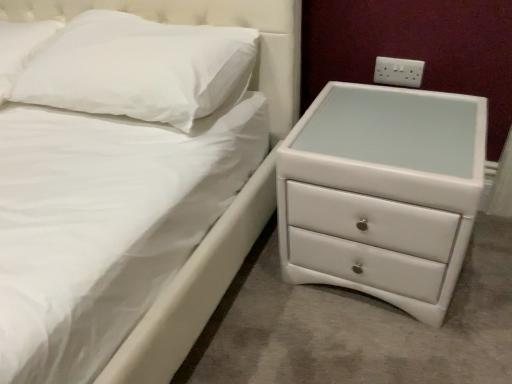
Measure the distance between point (375, 73) and camera.

Point (375, 73) and camera are 1.39 meters apart from each other.

The height and width of the screenshot is (384, 512). I want to click on white glossy chest of drawers at right, so click(x=382, y=193).

Is white plastic electrical outlet at upper right closer to the viewer compared to white matte pillow at upper left, which is counted as the 1th pillow, starting from the left?

No, the depth of white plastic electrical outlet at upper right is greater than that of white matte pillow at upper left, which is counted as the 1th pillow, starting from the left.

Is white plastic electrical outlet at upper right taller or shorter than white matte pillow at upper left, arranged as the 2th pillow when viewed from the right?

Clearly, white plastic electrical outlet at upper right is shorter compared to white matte pillow at upper left, arranged as the 2th pillow when viewed from the right.

Is white plastic electrical outlet at upper right spatially inside white matte pillow at upper left, arranged as the 2th pillow when viewed from the right, or outside of it?

The correct answer is: outside.

Does white plastic electrical outlet at upper right turn towards white matte pillow at upper left, arranged as the 2th pillow when viewed from the right?

No, white plastic electrical outlet at upper right is not oriented towards white matte pillow at upper left, arranged as the 2th pillow when viewed from the right.

Considering the relative sizes of white soft pillow at upper left, marked as the second pillow in a left-to-right arrangement, and white plastic electrical outlet at upper right in the image provided, is white soft pillow at upper left, marked as the second pillow in a left-to-right arrangement, thinner than white plastic electrical outlet at upper right?

No.

Is point (168, 36) behind point (399, 79)?

No, (168, 36) is in front of (399, 79).

Based on the photo, can we say white soft pillow at upper left, marked as the second pillow in a left-to-right arrangement, lies outside white plastic electrical outlet at upper right?

Indeed, white soft pillow at upper left, marked as the second pillow in a left-to-right arrangement, is completely outside white plastic electrical outlet at upper right.

Consider the image. From the image's perspective, is white soft pillow at upper left, marked as the second pillow in a left-to-right arrangement, over white plastic electrical outlet at upper right?

No, from the image's perspective, white soft pillow at upper left, marked as the second pillow in a left-to-right arrangement, is not on top of white plastic electrical outlet at upper right.

Which is more to the left, white matte pillow at upper left, arranged as the 2th pillow when viewed from the right, or white glossy chest of drawers at right?

From the viewer's perspective, white matte pillow at upper left, arranged as the 2th pillow when viewed from the right, appears more on the left side.

How distant is white matte pillow at upper left, which is counted as the 1th pillow, starting from the left, from white glossy chest of drawers at right?

1.08 meters.

From a real-world perspective, is white matte pillow at upper left, arranged as the 2th pillow when viewed from the right, below white glossy chest of drawers at right?

No, from a real-world perspective, white matte pillow at upper left, arranged as the 2th pillow when viewed from the right, is not below white glossy chest of drawers at right.

Relative to white glossy chest of drawers at right, is white matte pillow at upper left, which is counted as the 1th pillow, starting from the left, in front or behind?

white matte pillow at upper left, which is counted as the 1th pillow, starting from the left, is behind white glossy chest of drawers at right.

Based on the photo, does white soft pillow at upper left, marked as the second pillow in a left-to-right arrangement, have a lesser height compared to white matte pillow at upper left, arranged as the 2th pillow when viewed from the right?

No.

Which is less distant, (x=154, y=81) or (x=2, y=70)?

Positioned in front is point (x=154, y=81).

Is white matte pillow at upper left, which is counted as the 1th pillow, starting from the left, at the back of white soft pillow at upper left, which is the first pillow in right-to-left order?

No.

Does white plastic electrical outlet at upper right have a larger size compared to white glossy chest of drawers at right?

No.

Would you say white plastic electrical outlet at upper right is to the left or to the right of white glossy chest of drawers at right in the picture?

white plastic electrical outlet at upper right is positioned on white glossy chest of drawers at right's right side.

Is white plastic electrical outlet at upper right turned away from white glossy chest of drawers at right?

white plastic electrical outlet at upper right does not have its back to white glossy chest of drawers at right.

From a real-world perspective, which is physically below, white plastic electrical outlet at upper right or white glossy chest of drawers at right?

white glossy chest of drawers at right.

From the image's perspective, is white matte pillow at upper left, arranged as the 2th pillow when viewed from the right, over white soft pillow at upper left, which is the first pillow in right-to-left order?

Yes, from the image's perspective, white matte pillow at upper left, arranged as the 2th pillow when viewed from the right, is on top of white soft pillow at upper left, which is the first pillow in right-to-left order.

Which is closer, (10, 92) or (227, 85)?

Point (10, 92).

From a real-world perspective, is white matte pillow at upper left, which is counted as the 1th pillow, starting from the left, above or below white soft pillow at upper left, marked as the second pillow in a left-to-right arrangement?

From a real-world perspective, white matte pillow at upper left, which is counted as the 1th pillow, starting from the left, is physically below white soft pillow at upper left, marked as the second pillow in a left-to-right arrangement.

Would you say white matte pillow at upper left, arranged as the 2th pillow when viewed from the right, is inside or outside white soft pillow at upper left, marked as the second pillow in a left-to-right arrangement?

white matte pillow at upper left, arranged as the 2th pillow when viewed from the right, lies outside white soft pillow at upper left, marked as the second pillow in a left-to-right arrangement.

From the image's perspective, which one is positioned lower, white glossy chest of drawers at right or white plastic electrical outlet at upper right?

white glossy chest of drawers at right, from the image's perspective.

Is point (292, 149) closer or farther from the camera than point (396, 77)?

Point (292, 149).

Do you think white glossy chest of drawers at right is within white plastic electrical outlet at upper right, or outside of it?

white glossy chest of drawers at right is not inside white plastic electrical outlet at upper right, it's outside.

I want to click on the 1st pillow in front when counting from the white plastic electrical outlet at upper right, so click(x=21, y=48).

Find the location of a particular element. The width and height of the screenshot is (512, 384). electric outlet that appears above the white soft pillow at upper left, which is the first pillow in right-to-left order (from the image's perspective) is located at coordinates (398, 72).

When comparing their distances from white soft pillow at upper left, which is the first pillow in right-to-left order, does white glossy chest of drawers at right or white matte pillow at upper left, arranged as the 2th pillow when viewed from the right, seem closer?

white matte pillow at upper left, arranged as the 2th pillow when viewed from the right, lies closer to white soft pillow at upper left, which is the first pillow in right-to-left order, than the other object.

Which object lies further to the anchor point white matte pillow at upper left, which is counted as the 1th pillow, starting from the left, white soft pillow at upper left, which is the first pillow in right-to-left order, or white glossy chest of drawers at right?

white glossy chest of drawers at right.

Based on their spatial positions, is white matte pillow at upper left, arranged as the 2th pillow when viewed from the right, or white plastic electrical outlet at upper right closer to white glossy chest of drawers at right?

Based on the image, white plastic electrical outlet at upper right appears to be nearer to white glossy chest of drawers at right.

Based on their spatial positions, is white glossy chest of drawers at right or white plastic electrical outlet at upper right further from white soft pillow at upper left, marked as the second pillow in a left-to-right arrangement?

white plastic electrical outlet at upper right lies further to white soft pillow at upper left, marked as the second pillow in a left-to-right arrangement, than the other object.

Based on their spatial positions, is white glossy chest of drawers at right or white soft pillow at upper left, marked as the second pillow in a left-to-right arrangement, further from white plastic electrical outlet at upper right?

white soft pillow at upper left, marked as the second pillow in a left-to-right arrangement, is further to white plastic electrical outlet at upper right.

Estimate the real-world distances between objects in this image. Which object is closer to white plastic electrical outlet at upper right, white soft pillow at upper left, marked as the second pillow in a left-to-right arrangement, or white matte pillow at upper left, arranged as the 2th pillow when viewed from the right?

white soft pillow at upper left, marked as the second pillow in a left-to-right arrangement.

Looking at the image, which one is located further to white plastic electrical outlet at upper right, white matte pillow at upper left, which is counted as the 1th pillow, starting from the left, or white soft pillow at upper left, which is the first pillow in right-to-left order?

The object further to white plastic electrical outlet at upper right is white matte pillow at upper left, which is counted as the 1th pillow, starting from the left.

From the image, which object appears to be nearer to white glossy chest of drawers at right, white soft pillow at upper left, which is the first pillow in right-to-left order, or white matte pillow at upper left, arranged as the 2th pillow when viewed from the right?

The object closer to white glossy chest of drawers at right is white soft pillow at upper left, which is the first pillow in right-to-left order.

In order to click on chest of drawers between white matte pillow at upper left, arranged as the 2th pillow when viewed from the right, and white plastic electrical outlet at upper right in this screenshot , I will do `click(382, 193)`.

Where is `pillow situated between white matte pillow at upper left, which is counted as the 1th pillow, starting from the left, and white glossy chest of drawers at right from left to right`? The height and width of the screenshot is (384, 512). pillow situated between white matte pillow at upper left, which is counted as the 1th pillow, starting from the left, and white glossy chest of drawers at right from left to right is located at coordinates (138, 68).

Where is `pillow between white matte pillow at upper left, which is counted as the 1th pillow, starting from the left, and white plastic electrical outlet at upper right from left to right`? Image resolution: width=512 pixels, height=384 pixels. pillow between white matte pillow at upper left, which is counted as the 1th pillow, starting from the left, and white plastic electrical outlet at upper right from left to right is located at coordinates (138, 68).

Find the location of a particular element. Image resolution: width=512 pixels, height=384 pixels. chest of drawers between white soft pillow at upper left, which is the first pillow in right-to-left order, and white plastic electrical outlet at upper right from left to right is located at coordinates (382, 193).